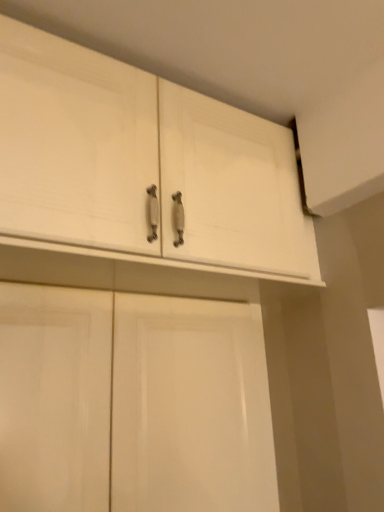
I want to click on white matte cabinet doors at lower center, the second cabinetry when ordered from top to bottom, so click(x=132, y=403).

This screenshot has height=512, width=384. Describe the element at coordinates (132, 403) in the screenshot. I see `white matte cabinet doors at lower center, arranged as the 1th cabinetry when ordered from the bottom` at that location.

This screenshot has width=384, height=512. Describe the element at coordinates (142, 164) in the screenshot. I see `white wood cabinet at upper center, the 1th cabinetry in the top-to-bottom sequence` at that location.

Measure the distance between white wood cabinet at upper center, placed as the 2th cabinetry when sorted from bottom to top, and camera.

white wood cabinet at upper center, placed as the 2th cabinetry when sorted from bottom to top, and camera are 25.10 inches apart.

How much space does white wood cabinet at upper center, the 1th cabinetry in the top-to-bottom sequence, occupy horizontally?

white wood cabinet at upper center, the 1th cabinetry in the top-to-bottom sequence, is 25.01 inches in width.

Locate an element on the screen. This screenshot has height=512, width=384. white wood cabinet at upper center, the 1th cabinetry in the top-to-bottom sequence is located at coordinates (142, 164).

The height and width of the screenshot is (512, 384). What are the coordinates of `white matte cabinet doors at lower center, arranged as the 1th cabinetry when ordered from the bottom` in the screenshot? It's located at (132, 403).

Can you confirm if white wood cabinet at upper center, placed as the 2th cabinetry when sorted from bottom to top, is positioned to the right of white matte cabinet doors at lower center, arranged as the 1th cabinetry when ordered from the bottom?

Correct, you'll find white wood cabinet at upper center, placed as the 2th cabinetry when sorted from bottom to top, to the right of white matte cabinet doors at lower center, arranged as the 1th cabinetry when ordered from the bottom.

Is white wood cabinet at upper center, the 1th cabinetry in the top-to-bottom sequence, positioned behind white matte cabinet doors at lower center, the second cabinetry when ordered from top to bottom?

No, it is in front of white matte cabinet doors at lower center, the second cabinetry when ordered from top to bottom.

Between point (16, 52) and point (134, 304), which one is positioned behind?

The point (134, 304) is farther.

Consider the image. From the image's perspective, is white wood cabinet at upper center, the 1th cabinetry in the top-to-bottom sequence, on white matte cabinet doors at lower center, arranged as the 1th cabinetry when ordered from the bottom?

Yes, from the image's perspective, white wood cabinet at upper center, the 1th cabinetry in the top-to-bottom sequence, is above white matte cabinet doors at lower center, arranged as the 1th cabinetry when ordered from the bottom.

From a real-world perspective, between white wood cabinet at upper center, placed as the 2th cabinetry when sorted from bottom to top, and white matte cabinet doors at lower center, the second cabinetry when ordered from top to bottom, who is vertically higher?

From a 3D spatial view, white wood cabinet at upper center, placed as the 2th cabinetry when sorted from bottom to top, is above.

Does white wood cabinet at upper center, the 1th cabinetry in the top-to-bottom sequence, have a lesser width compared to white matte cabinet doors at lower center, the second cabinetry when ordered from top to bottom?

No, white wood cabinet at upper center, the 1th cabinetry in the top-to-bottom sequence, is not thinner than white matte cabinet doors at lower center, the second cabinetry when ordered from top to bottom.

Is white wood cabinet at upper center, the 1th cabinetry in the top-to-bottom sequence, taller than white matte cabinet doors at lower center, arranged as the 1th cabinetry when ordered from the bottom?

Incorrect, the height of white wood cabinet at upper center, the 1th cabinetry in the top-to-bottom sequence, is not larger of that of white matte cabinet doors at lower center, arranged as the 1th cabinetry when ordered from the bottom.

Considering the sizes of white wood cabinet at upper center, placed as the 2th cabinetry when sorted from bottom to top, and white matte cabinet doors at lower center, the second cabinetry when ordered from top to bottom, in the image, is white wood cabinet at upper center, placed as the 2th cabinetry when sorted from bottom to top, bigger or smaller than white matte cabinet doors at lower center, the second cabinetry when ordered from top to bottom,?

Clearly, white wood cabinet at upper center, placed as the 2th cabinetry when sorted from bottom to top, is larger in size than white matte cabinet doors at lower center, the second cabinetry when ordered from top to bottom.

Would you say white wood cabinet at upper center, the 1th cabinetry in the top-to-bottom sequence, contains white matte cabinet doors at lower center, the second cabinetry when ordered from top to bottom?

No, white matte cabinet doors at lower center, the second cabinetry when ordered from top to bottom, is not inside white wood cabinet at upper center, the 1th cabinetry in the top-to-bottom sequence.

Is white wood cabinet at upper center, the 1th cabinetry in the top-to-bottom sequence, directly adjacent to white matte cabinet doors at lower center, the second cabinetry when ordered from top to bottom?

No, white wood cabinet at upper center, the 1th cabinetry in the top-to-bottom sequence, is not in contact with white matte cabinet doors at lower center, the second cabinetry when ordered from top to bottom.

Is white wood cabinet at upper center, the 1th cabinetry in the top-to-bottom sequence, looking in the opposite direction of white matte cabinet doors at lower center, arranged as the 1th cabinetry when ordered from the bottom?

That's not correct — white wood cabinet at upper center, the 1th cabinetry in the top-to-bottom sequence, is not looking away from white matte cabinet doors at lower center, arranged as the 1th cabinetry when ordered from the bottom.

I want to click on cabinetry on the right of white matte cabinet doors at lower center, the second cabinetry when ordered from top to bottom, so click(x=142, y=164).

Which is more to the left, white matte cabinet doors at lower center, arranged as the 1th cabinetry when ordered from the bottom, or white wood cabinet at upper center, the 1th cabinetry in the top-to-bottom sequence?

white matte cabinet doors at lower center, arranged as the 1th cabinetry when ordered from the bottom.

Is white matte cabinet doors at lower center, arranged as the 1th cabinetry when ordered from the bottom, positioned before white wood cabinet at upper center, placed as the 2th cabinetry when sorted from bottom to top?

No, the depth of white matte cabinet doors at lower center, arranged as the 1th cabinetry when ordered from the bottom, is greater than that of white wood cabinet at upper center, placed as the 2th cabinetry when sorted from bottom to top.

Which is behind, point (159, 507) or point (62, 186)?

Positioned behind is point (159, 507).

Based on the photo, from the image's perspective, is white matte cabinet doors at lower center, arranged as the 1th cabinetry when ordered from the bottom, above or below white wood cabinet at upper center, the 1th cabinetry in the top-to-bottom sequence?

white matte cabinet doors at lower center, arranged as the 1th cabinetry when ordered from the bottom, is situated lower than white wood cabinet at upper center, the 1th cabinetry in the top-to-bottom sequence, in the image.

From the picture: From a real-world perspective, which object rests below the other?

From a 3D spatial view, white matte cabinet doors at lower center, arranged as the 1th cabinetry when ordered from the bottom, is below.

Does white matte cabinet doors at lower center, the second cabinetry when ordered from top to bottom, have a lesser width compared to white wood cabinet at upper center, placed as the 2th cabinetry when sorted from bottom to top?

Yes, white matte cabinet doors at lower center, the second cabinetry when ordered from top to bottom, is thinner than white wood cabinet at upper center, placed as the 2th cabinetry when sorted from bottom to top.

Who is shorter, white matte cabinet doors at lower center, the second cabinetry when ordered from top to bottom, or white wood cabinet at upper center, placed as the 2th cabinetry when sorted from bottom to top?

Standing shorter between the two is white wood cabinet at upper center, placed as the 2th cabinetry when sorted from bottom to top.

Which of these two, white matte cabinet doors at lower center, the second cabinetry when ordered from top to bottom, or white wood cabinet at upper center, the 1th cabinetry in the top-to-bottom sequence, is smaller?

white matte cabinet doors at lower center, the second cabinetry when ordered from top to bottom, is smaller.

Would you say white matte cabinet doors at lower center, arranged as the 1th cabinetry when ordered from the bottom, is inside or outside white wood cabinet at upper center, placed as the 2th cabinetry when sorted from bottom to top?

The correct answer is: outside.

Is white matte cabinet doors at lower center, arranged as the 1th cabinetry when ordered from the bottom, far from white wood cabinet at upper center, the 1th cabinetry in the top-to-bottom sequence?

No, white matte cabinet doors at lower center, arranged as the 1th cabinetry when ordered from the bottom, is not far away from white wood cabinet at upper center, the 1th cabinetry in the top-to-bottom sequence.

Is white matte cabinet doors at lower center, the second cabinetry when ordered from top to bottom, aimed at white wood cabinet at upper center, placed as the 2th cabinetry when sorted from bottom to top?

No, white matte cabinet doors at lower center, the second cabinetry when ordered from top to bottom, does not turn towards white wood cabinet at upper center, placed as the 2th cabinetry when sorted from bottom to top.

In the scene shown: What's the angular difference between white matte cabinet doors at lower center, the second cabinetry when ordered from top to bottom, and white wood cabinet at upper center, placed as the 2th cabinetry when sorted from bottom to top,'s facing directions?

0.000357 degrees separate the facing orientations of white matte cabinet doors at lower center, the second cabinetry when ordered from top to bottom, and white wood cabinet at upper center, placed as the 2th cabinetry when sorted from bottom to top.

Find the location of a particular element. The width and height of the screenshot is (384, 512). cabinetry below the white wood cabinet at upper center, the 1th cabinetry in the top-to-bottom sequence (from a real-world perspective) is located at coordinates coord(132,403).

Locate an element on the screen. The image size is (384, 512). cabinetry above the white matte cabinet doors at lower center, arranged as the 1th cabinetry when ordered from the bottom (from a real-world perspective) is located at coordinates (142, 164).

Where is `cabinetry in front of the white matte cabinet doors at lower center, the second cabinetry when ordered from top to bottom`? This screenshot has height=512, width=384. cabinetry in front of the white matte cabinet doors at lower center, the second cabinetry when ordered from top to bottom is located at coordinates (142, 164).